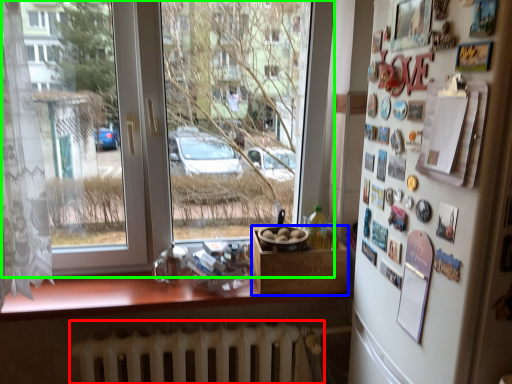
Question: Considering the real-world distances, which object is farthest from radiator (highlighted by a red box)? box (highlighted by a blue box) or window (highlighted by a green box)?

Choices:
 (A) box
 (B) window

Answer: (B)